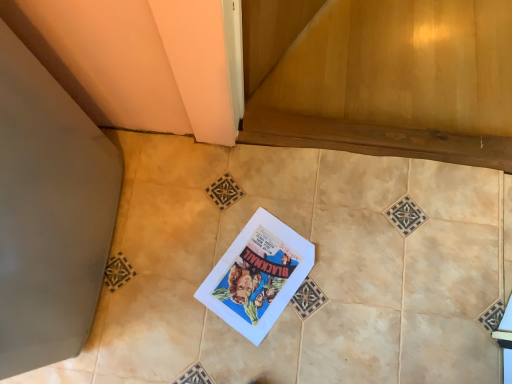
At what (x,y) coordinates should I click in order to perform the action: click on vacant space that is to the left of matte paper comic book at center. Please return your answer as a coordinate pair (x, y). The height and width of the screenshot is (384, 512). Looking at the image, I should click on (177, 271).